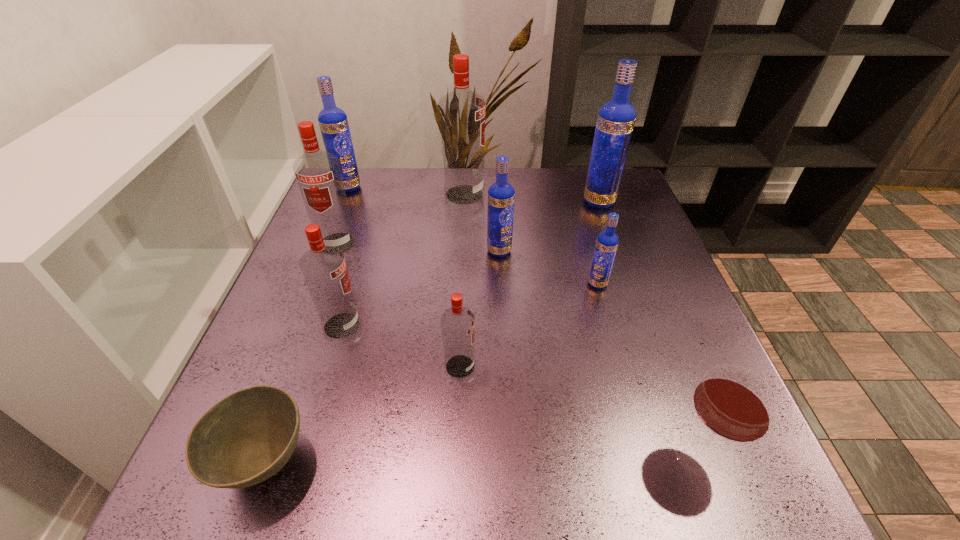
You are a GUI agent. You are given a task and a screenshot of the screen. Output one action in this format:
    pyautogui.click(x=<x>, y=<y>)
    Task: Click on the biggest red vodka
    This screenshot has height=540, width=960.
    Given the screenshot: What is the action you would take?
    pyautogui.click(x=462, y=112)

The image size is (960, 540). In order to click on the biggest blue vodka in this screenshot , I will do `click(616, 118)`.

Where is `the rightmost vodka`? Image resolution: width=960 pixels, height=540 pixels. the rightmost vodka is located at coordinates (616, 118).

At what (x,y) coordinates should I click in order to perform the action: click on the third smallest blue vodka. Please return your answer as a coordinate pair (x, y). This screenshot has width=960, height=540. Looking at the image, I should click on (x=333, y=122).

You are a GUI agent. You are given a task and a screenshot of the screen. Output one action in this format:
    pyautogui.click(x=<x>, y=<y>)
    Task: Click on the second farthest red vodka
    Image resolution: width=960 pixels, height=540 pixels.
    Given the screenshot: What is the action you would take?
    pyautogui.click(x=318, y=174)

Find the location of a particular element. Image resolution: width=960 pixels, height=540 pixels. the fourth object from right to left is located at coordinates (501, 195).

The width and height of the screenshot is (960, 540). What are the coordinates of `the third vodka from right to left` in the screenshot? It's located at (501, 195).

Find the location of a particular element. The image size is (960, 540). the third biggest red vodka is located at coordinates (324, 268).

At what (x,y) coordinates should I click in order to perform the action: click on the second nearest vodka. Please return your answer as a coordinate pair (x, y). Looking at the image, I should click on (324, 268).

Locate an element on the screen. Image resolution: width=960 pixels, height=540 pixels. the fifth nearest object is located at coordinates (607, 242).